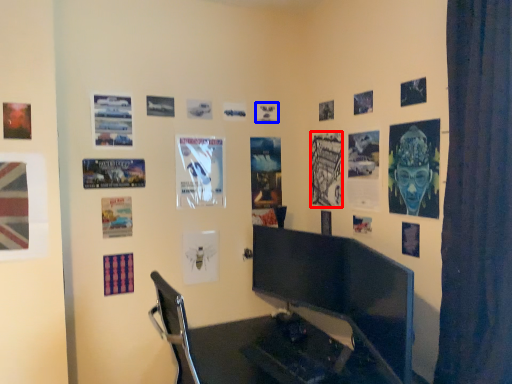
Question: Which of the following is the closest to the observer, poster page (highlighted by a red box) or poster page (highlighted by a blue box)?

Choices:
 (A) poster page
 (B) poster page

Answer: (A)